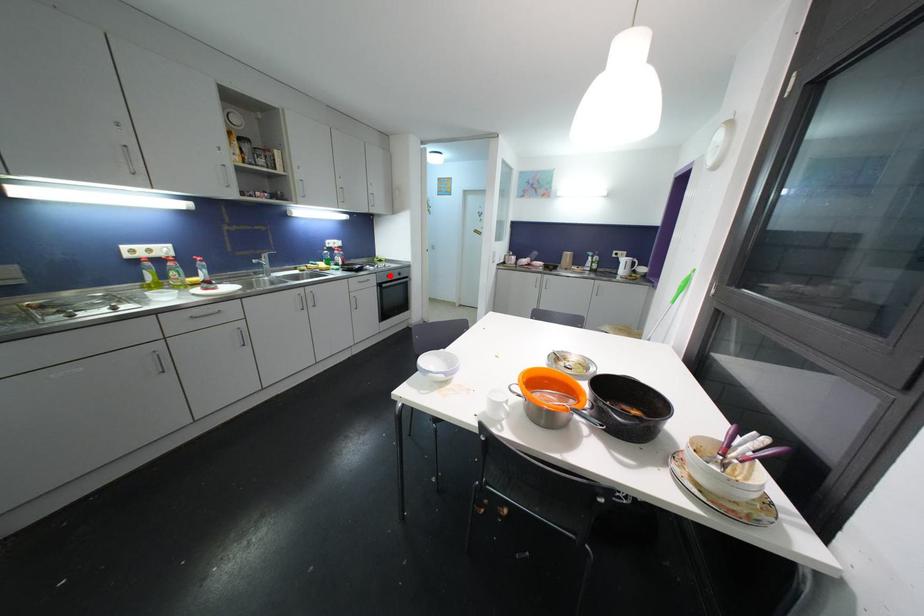
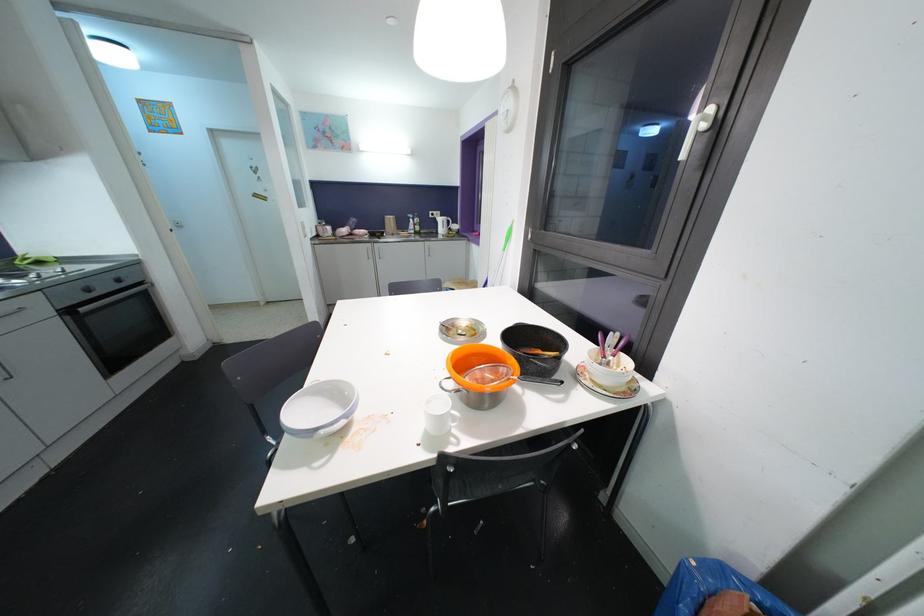
Where in the second image is the point corresponding to the highlighted location from the first image?

(83, 286)